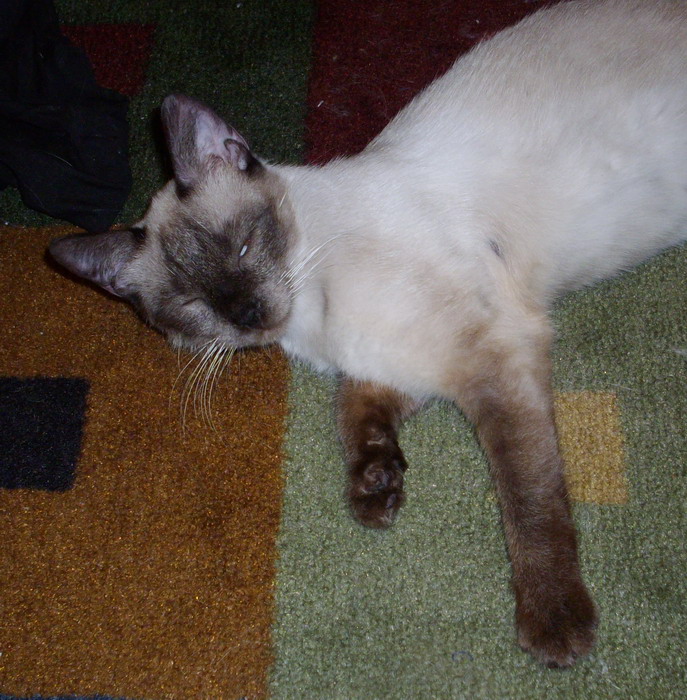
Find the location of `brown rug`. brown rug is located at coordinates (187, 495).